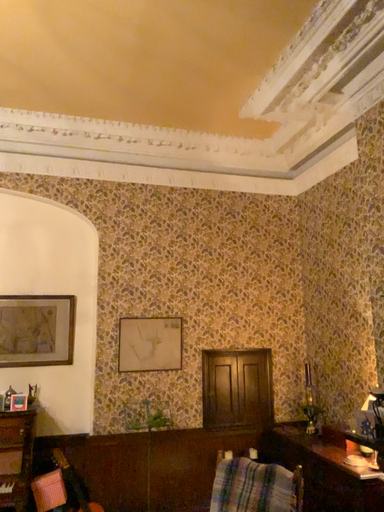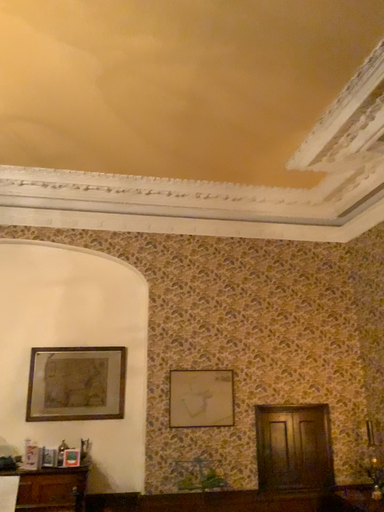
Question: How did the camera likely rotate when shooting the video?

Choices:
 (A) rotated downward
 (B) rotated upward

Answer: (B)